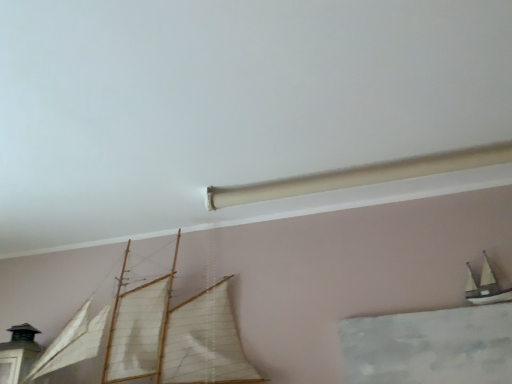
Question: Relative to white matte sailboat at upper right, arranged as the 1th boat when viewed from the right, is wooden sailboat at center, the 2th boat viewed from the right, in front or behind?

Choices:
 (A) behind
 (B) front

Answer: (B)

Question: Is wooden sailboat at center, the 1th boat positioned from the left, spatially inside white matte sailboat at upper right, placed as the second boat when sorted from left to right, or outside of it?

Choices:
 (A) inside
 (B) outside

Answer: (B)

Question: From a real-world perspective, is wooden sailboat at center, the 2th boat viewed from the right, physically located above or below white matte sailboat at upper right, placed as the second boat when sorted from left to right?

Choices:
 (A) below
 (B) above

Answer: (B)

Question: From the image's perspective, relative to wooden sailboat at center, the 2th boat viewed from the right, is white matte sailboat at upper right, placed as the second boat when sorted from left to right, above or below?

Choices:
 (A) below
 (B) above

Answer: (B)

Question: Is white matte sailboat at upper right, placed as the second boat when sorted from left to right, wider or thinner than wooden sailboat at center, the 2th boat viewed from the right?

Choices:
 (A) wide
 (B) thin

Answer: (B)

Question: Which is correct: white matte sailboat at upper right, arranged as the 1th boat when viewed from the right, is inside wooden sailboat at center, the 1th boat positioned from the left, or outside of it?

Choices:
 (A) inside
 (B) outside

Answer: (B)

Question: From a real-world perspective, is white matte sailboat at upper right, arranged as the 1th boat when viewed from the right, physically located above or below wooden sailboat at center, the 1th boat positioned from the left?

Choices:
 (A) below
 (B) above

Answer: (A)